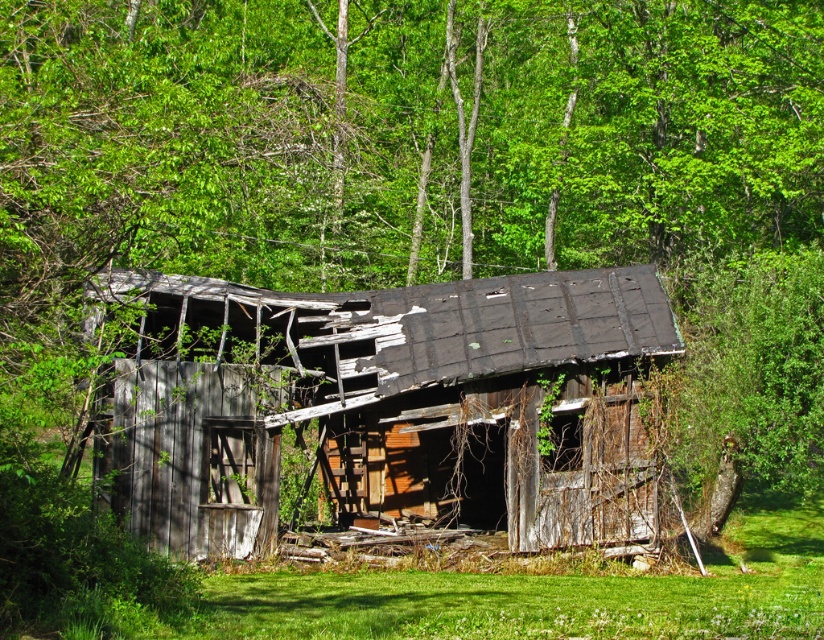
You are a hiker who wants to set up a tent in the area shown in the image. Given that the weathered wood barn at center and the green grass at lower center are present, which area would you choose to set up your tent and why?

You should set up your tent on the green grass at lower center because it occupies more space than the weathered wood barn at center, providing a larger and safer area for camping.

You are standing in front of the old wooden shed in the forest. You notice two points marked in the image. The first point is at coordinates point (233, 440), and the second point is at point (724, 577). Which of these two points is closer to you as you face the shed?

Point (233, 440) is closer to you because it is in front of point (724, 577).

You are standing on the green grass at lower center and want to enter the weathered wood barn at center. Is the barn directly above you, or do you need to move to reach it?

The weathered wood barn at center is positioned over green grass at lower center, so you are already standing directly under the barn and can enter it without needing to move further.